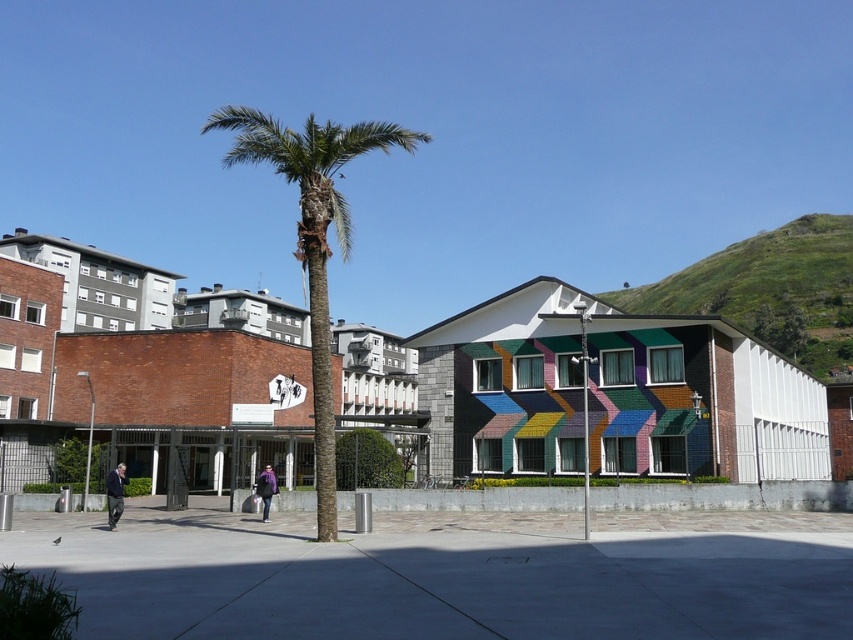
Can you confirm if dark gray pants at lower left is shorter than purple fabric bag at center?

No, dark gray pants at lower left is not shorter than purple fabric bag at center.

Which is in front, point (122, 481) or point (257, 486)?

Point (122, 481) is in front.

Find the location of a particular element. This screenshot has height=640, width=853. dark gray pants at lower left is located at coordinates (115, 493).

Which is behind, point (717, 557) or point (339, 216)?

Positioned behind is point (339, 216).

Which of these two, smooth concrete pavement at center or green leafy palm tree at center, stands shorter?

smooth concrete pavement at center is shorter.

Between point (128, 570) and point (334, 168), which one is positioned in front?

Point (128, 570) is in front.

Locate an element on the screen. smooth concrete pavement at center is located at coordinates (450, 577).

Consider the image. Who is more forward, [482,538] or [264,500]?

Point [482,538] is more forward.

Which is below, smooth concrete pavement at center or purple fabric bag at center?

purple fabric bag at center is below.

Identify the location of smooth concrete pavement at center. This screenshot has width=853, height=640. (450, 577).